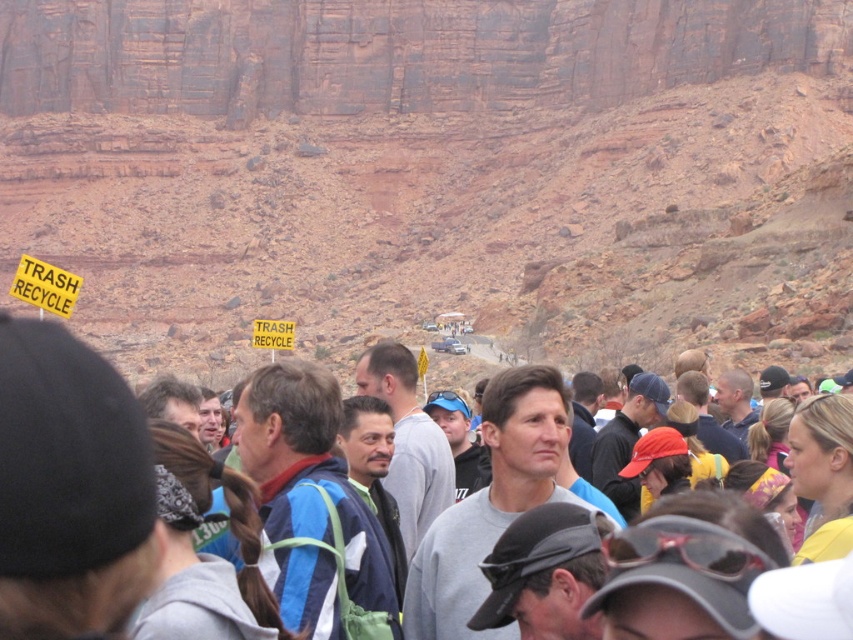
Can you confirm if gray casual clothing at center is positioned to the right of yellow paper sign at center?

Indeed, gray casual clothing at center is positioned on the right side of yellow paper sign at center.

Who is more distant from viewer, [35,592] or [285,326]?

Point [285,326]

The height and width of the screenshot is (640, 853). Find the location of `gray casual clothing at center`. gray casual clothing at center is located at coordinates (71, 490).

Does gray casual clothing at center appear on the left side of yellow paper sign at upper left?

In fact, gray casual clothing at center is to the right of yellow paper sign at upper left.

Is gray casual clothing at center bigger than yellow paper sign at upper left?

Actually, gray casual clothing at center might be smaller than yellow paper sign at upper left.

Who is more forward, (x=3, y=433) or (x=67, y=276)?

Point (x=3, y=433)

Locate an element on the screen. This screenshot has width=853, height=640. gray casual clothing at center is located at coordinates (71, 490).

Consider the image. Who is positioned more to the left, yellow paper sign at upper left or yellow paper sign at center?

yellow paper sign at upper left

At what (x,y) coordinates should I click in order to perform the action: click on yellow paper sign at upper left. Please return your answer as a coordinate pair (x, y). Looking at the image, I should click on (45, 285).